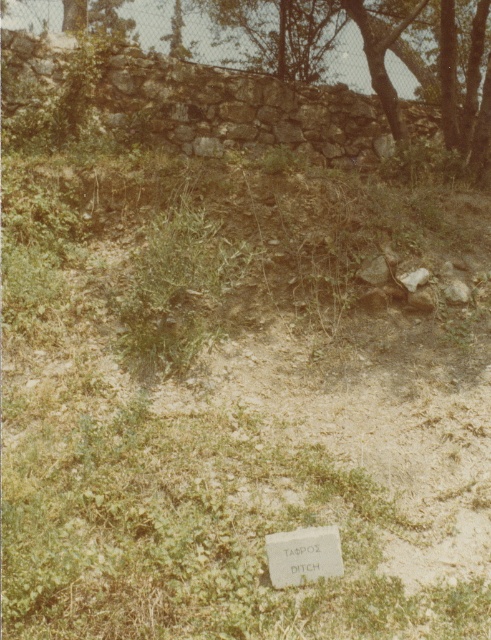
Does dark green leafy tree at upper center have a greater height compared to white stone plaque at center?

Indeed, dark green leafy tree at upper center has a greater height compared to white stone plaque at center.

Can you confirm if dark green leafy tree at upper center is shorter than white stone plaque at center?

No, dark green leafy tree at upper center is not shorter than white stone plaque at center.

At what (x,y) coordinates should I click in order to perform the action: click on dark green leafy tree at upper center. Please return your answer as a coordinate pair (x, y). Image resolution: width=491 pixels, height=640 pixels. Looking at the image, I should click on (285, 76).

What are the coordinates of `dark green leafy tree at upper center` in the screenshot? It's located at (285, 76).